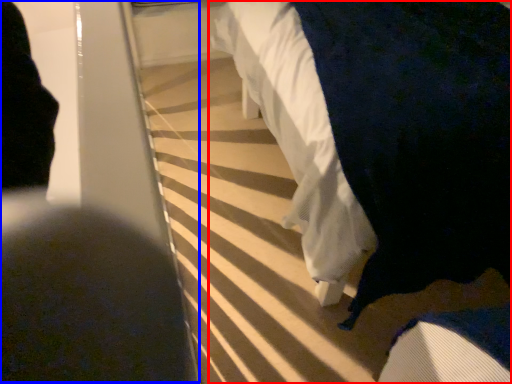
Question: Which point is further to the camera, furniture (highlighted by a red box) or person (highlighted by a blue box)?

Choices:
 (A) furniture
 (B) person

Answer: (A)